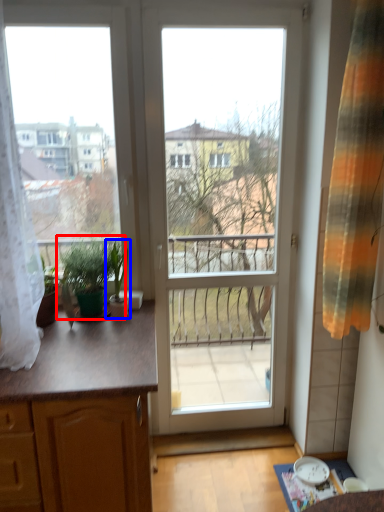
Question: Among these objects, which one is farthest to the camera, houseplant (highlighted by a red box) or houseplant (highlighted by a blue box)?

Choices:
 (A) houseplant
 (B) houseplant

Answer: (B)